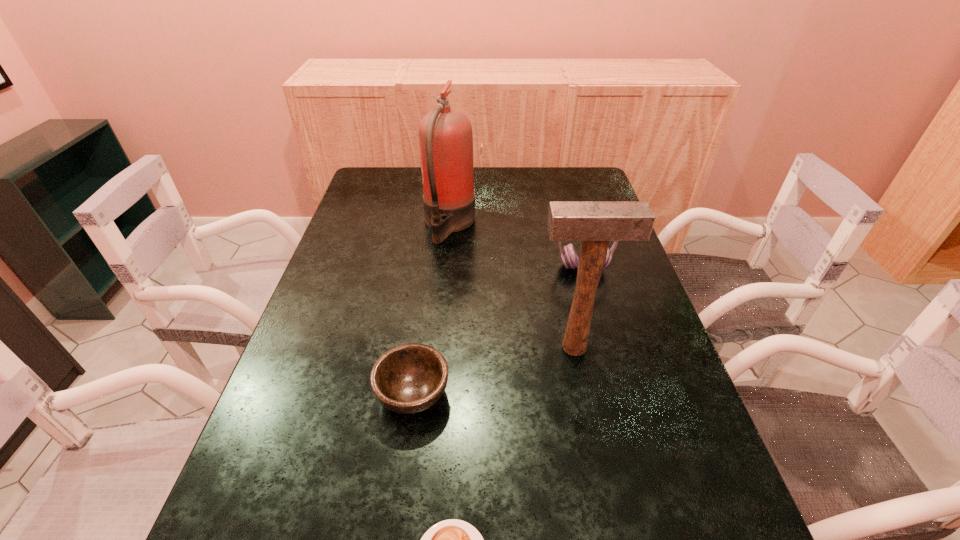
At what (x,y) coordinates should I click in order to perform the action: click on mallet positioned at the right edge. Please return your answer as a coordinate pair (x, y). The width and height of the screenshot is (960, 540). Looking at the image, I should click on (595, 223).

Identify the location of headset present at the right edge. This screenshot has height=540, width=960. (569, 256).

Locate an element on the screen. The image size is (960, 540). vacant space at the far edge of the desktop is located at coordinates (476, 183).

I want to click on free space at the left edge of the desktop, so click(x=284, y=512).

In order to click on blank area at the right edge in this screenshot , I will do `click(678, 387)`.

At what (x,y) coordinates should I click in order to perform the action: click on free space at the far left corner. Please return your answer as a coordinate pair (x, y). The height and width of the screenshot is (540, 960). Looking at the image, I should click on (402, 195).

This screenshot has width=960, height=540. Find the location of `vacant space in between the mallet and the farthest object`. vacant space in between the mallet and the farthest object is located at coordinates (512, 286).

What are the coordinates of `free space between the farthest object and the third shortest object` in the screenshot? It's located at (516, 245).

Locate an element on the screen. empty space between the fourth farthest object and the farthest object is located at coordinates pyautogui.click(x=431, y=309).

Locate an element on the screen. free area in between the mallet and the bowl is located at coordinates (493, 370).